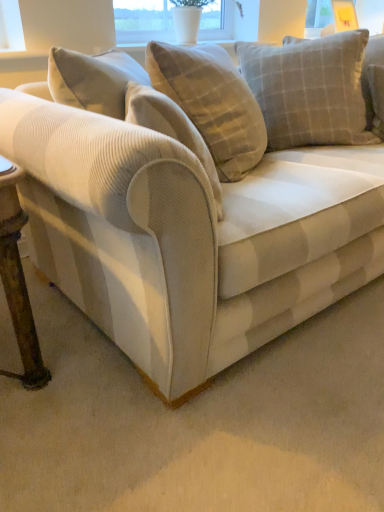
This screenshot has height=512, width=384. What do you see at coordinates (143, 21) in the screenshot?
I see `transparent glass window screen at upper center` at bounding box center [143, 21].

What do you see at coordinates (189, 230) in the screenshot? I see `velvet beige couch at center` at bounding box center [189, 230].

Where is `transparent glass window screen at upper center`? This screenshot has height=512, width=384. transparent glass window screen at upper center is located at coordinates (143, 21).

From the image's perspective, is transparent glass window screen at upper center located above light gray checkered cushion at upper right?

Correct, transparent glass window screen at upper center appears higher than light gray checkered cushion at upper right in the image.

Is transparent glass window screen at upper center taller or shorter than light gray checkered cushion at upper right?

In the image, transparent glass window screen at upper center appears to be shorter than light gray checkered cushion at upper right.

Does transparent glass window screen at upper center have a smaller size compared to light gray checkered cushion at upper right?

Indeed, transparent glass window screen at upper center has a smaller size compared to light gray checkered cushion at upper right.

Would you say transparent glass window screen at upper center is outside light gray checkered cushion at upper right?

transparent glass window screen at upper center is positioned outside light gray checkered cushion at upper right.

Is velvet beige couch at center positioned with its back to light gray checkered cushion at upper right?

Yes, velvet beige couch at center is positioned with its back facing light gray checkered cushion at upper right.

Find the location of a particular element. The width and height of the screenshot is (384, 512). pillow on the right of velvet beige couch at center is located at coordinates (310, 89).

Considering the sizes of objects velvet beige couch at center and light gray checkered cushion at upper right in the image provided, who is wider, velvet beige couch at center or light gray checkered cushion at upper right?

velvet beige couch at center.

Looking at this image, from the image's perspective, relative to light gray checkered cushion at upper right, is velvet beige couch at center above or below?

velvet beige couch at center is situated lower than light gray checkered cushion at upper right in the image.

Where is `window screen behind the velvet beige couch at center`? This screenshot has width=384, height=512. window screen behind the velvet beige couch at center is located at coordinates (143, 21).

Between velvet beige couch at center and transparent glass window screen at upper center, which one has less height?

transparent glass window screen at upper center is shorter.

From the picture: Between velvet beige couch at center and transparent glass window screen at upper center, which one has smaller size?

transparent glass window screen at upper center.

From the image's perspective, which is above, transparent glass window screen at upper center or velvet beige couch at center?

transparent glass window screen at upper center.

From the picture: Is transparent glass window screen at upper center positioned beyond the bounds of velvet beige couch at center?

Yes, transparent glass window screen at upper center is located beyond the bounds of velvet beige couch at center.

Which point is more distant from viewer, (226, 0) or (66, 219)?

The point (226, 0) is behind.

Which is more distant, (308,129) or (211,49)?

The point (308,129) is farther.

Is light gray checkered cushion at upper right shorter than velvet beige couch at center?

Indeed, light gray checkered cushion at upper right has a lesser height compared to velvet beige couch at center.

Could you tell me if light gray checkered cushion at upper right is turned towards velvet beige couch at center?

Yes, light gray checkered cushion at upper right faces towards velvet beige couch at center.

Consider the image. Is light gray checkered cushion at upper right to the left or to the right of velvet beige couch at center in the image?

light gray checkered cushion at upper right is to the right of velvet beige couch at center.

Can you confirm if light gray checkered cushion at upper right is taller than transparent glass window screen at upper center?

Correct, light gray checkered cushion at upper right is much taller as transparent glass window screen at upper center.

From the image's perspective, which one is positioned higher, light gray checkered cushion at upper right or transparent glass window screen at upper center?

transparent glass window screen at upper center is shown above in the image.

Considering the relative positions of light gray checkered cushion at upper right and transparent glass window screen at upper center in the image provided, is light gray checkered cushion at upper right to the left or to the right of transparent glass window screen at upper center?

Based on their positions, light gray checkered cushion at upper right is located to the right of transparent glass window screen at upper center.

Image resolution: width=384 pixels, height=512 pixels. There is a light gray checkered cushion at upper right. What are the coordinates of `window screen above it (from a real-world perspective)` in the screenshot? It's located at pos(143,21).

Find the location of a particular element. Image resolution: width=384 pixels, height=512 pixels. studio couch located in front of the light gray checkered cushion at upper right is located at coordinates (189, 230).

Considering their positions, is light gray checkered cushion at upper right positioned further to velvet beige couch at center than transparent glass window screen at upper center?

The object further to velvet beige couch at center is transparent glass window screen at upper center.

Based on the photo, considering their positions, is transparent glass window screen at upper center positioned closer to velvet beige couch at center than light gray checkered cushion at upper right?

Result: light gray checkered cushion at upper right is closer to velvet beige couch at center.

Looking at the image, which one is located closer to transparent glass window screen at upper center, light gray checkered cushion at upper right or velvet beige couch at center?

Among the two, light gray checkered cushion at upper right is located nearer to transparent glass window screen at upper center.

Based on their spatial positions, is velvet beige couch at center or transparent glass window screen at upper center further from light gray checkered cushion at upper right?

transparent glass window screen at upper center.

When comparing their distances from light gray checkered cushion at upper right, does transparent glass window screen at upper center or velvet beige couch at center seem further?

transparent glass window screen at upper center lies further to light gray checkered cushion at upper right than the other object.

Considering their positions, is velvet beige couch at center positioned closer to transparent glass window screen at upper center than light gray checkered cushion at upper right?

light gray checkered cushion at upper right.

At what (x,y) coordinates should I click in order to perform the action: click on pillow between velvet beige couch at center and transparent glass window screen at upper center along the z-axis. Please return your answer as a coordinate pair (x, y). The height and width of the screenshot is (512, 384). Looking at the image, I should click on (310, 89).